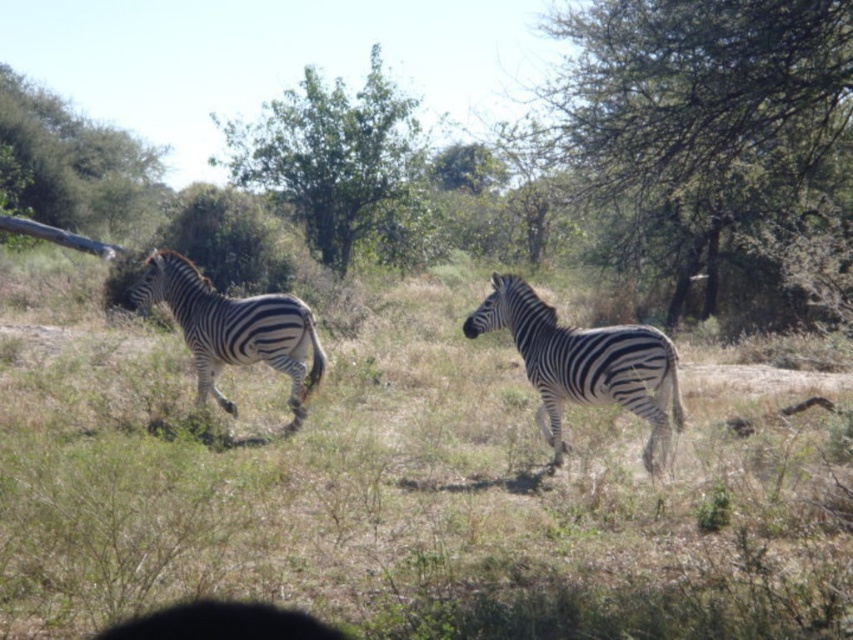
You are a safari guide explaining the scene to tourists. Pointing to the green leafy tree at center and the black and white striped zebra at center, you want to highlight their sizes. Which one is taller?

The green leafy tree at center is taller than the black and white striped zebra at center.

You are standing in the savanna scene. There is a point marked at coordinates (341, 166). What does this point indicate?

The point at coordinates (341, 166) marks the location of the green leafy tree at center.